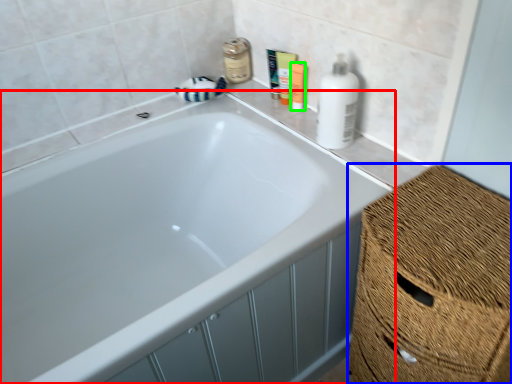
Question: Which object is the closest to the bathtub (highlighted by a red box)? Choose among these: basket (highlighted by a blue box) or toiletry (highlighted by a green box).

Choices:
 (A) basket
 (B) toiletry

Answer: (A)